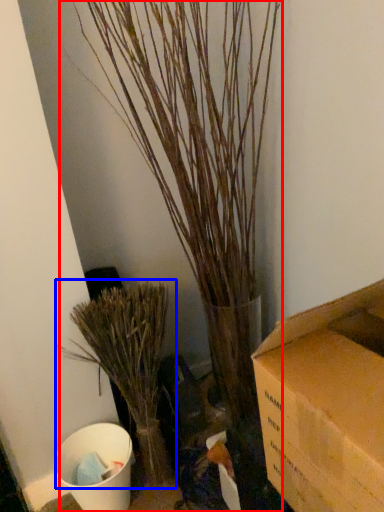
Question: Which object appears closest to the camera in this image, houseplant (highlighted by a red box) or houseplant (highlighted by a blue box)?

Choices:
 (A) houseplant
 (B) houseplant

Answer: (A)